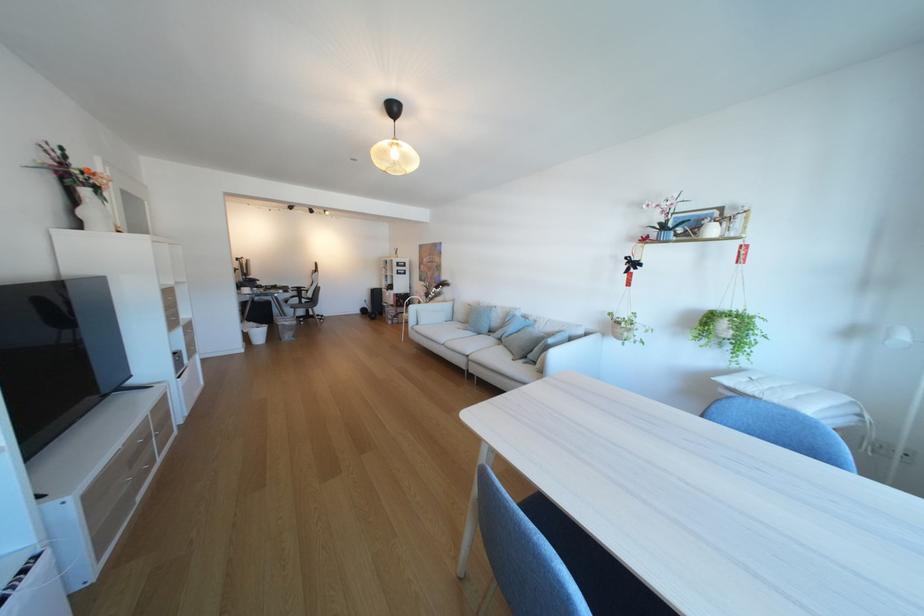
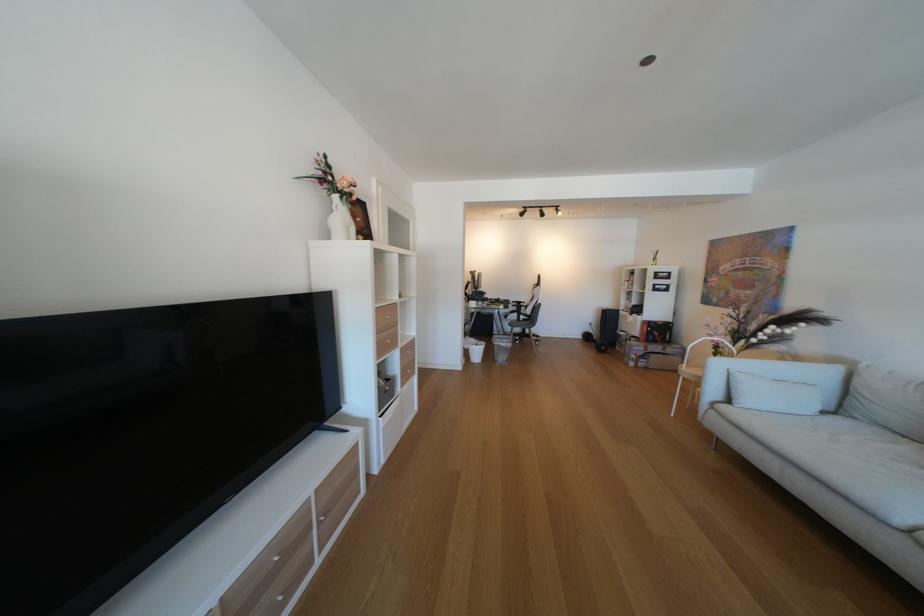
The point at (177, 310) is marked in the first image. Where is the corresponding point in the second image?

(390, 331)